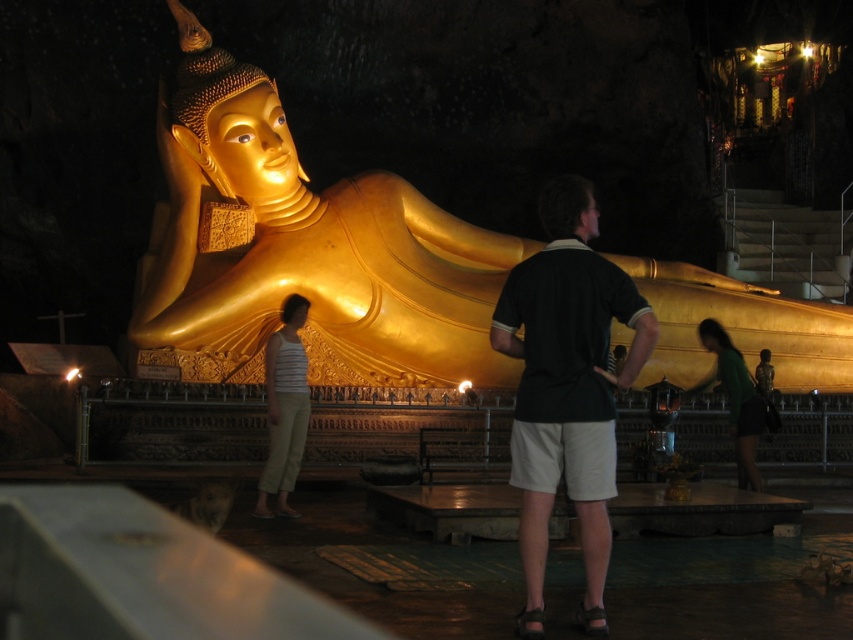
Question: Which point is closer to the camera?

Choices:
 (A) (514, 308)
 (B) (723, 364)

Answer: (A)

Question: Which point is farther to the camera?

Choices:
 (A) striped tank top at center
 (B) gold polished statue at center

Answer: (A)

Question: Where is gold polished statue at center located in relation to black cotton polo shirt at center in the image?

Choices:
 (A) right
 (B) left

Answer: (A)

Question: Is striped tank top at center further to the viewer compared to green matte shirt at lower right?

Choices:
 (A) yes
 (B) no

Answer: (B)

Question: Among these points, which one is farthest from the camera?

Choices:
 (A) (572, 497)
 (B) (215, 326)
 (C) (728, 364)
 (D) (287, 470)

Answer: (B)

Question: Is striped tank top at center positioned before green matte shirt at lower right?

Choices:
 (A) no
 (B) yes

Answer: (B)